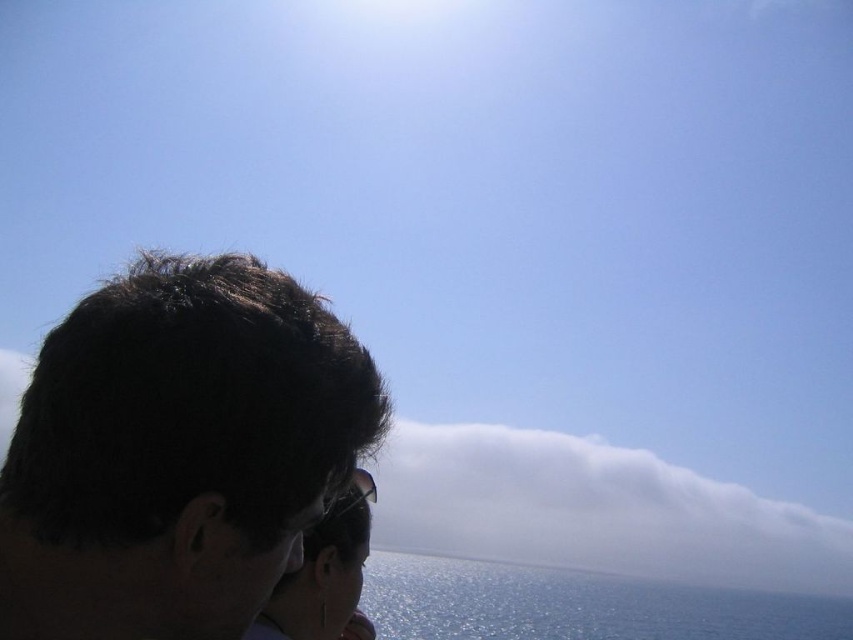
Consider the image. You are a photographer trying to capture a shot of the dark brown hair at left and the blue glossy water at lower center in the scene. Given the distance between them, would you need to adjust your camera settings to focus on both objects simultaneously?

The dark brown hair at left is 277.64 meters from the blue glossy water at lower center. Due to this significant distance, adjusting the camera settings to focus on both simultaneously may be challenging. A smaller aperture could increase depth of field to achieve focus on both objects.

You are a photographer trying to capture the reflection of the white fluffy cloud at lower center in the sunglasses at center. Can you see the reflection of the cloud in the sunglasses?

The sunglasses at center is behind the white fluffy cloud at lower center, so the reflection of the cloud would not be visible in the sunglasses.